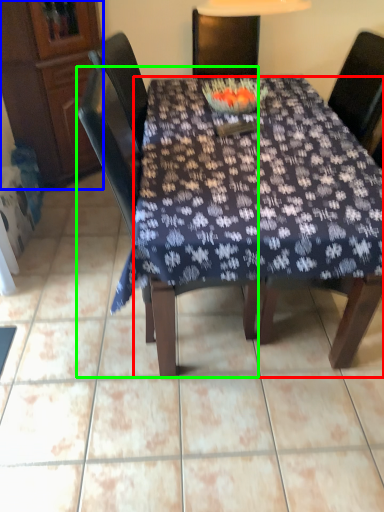
Question: Considering the real-world distances, which object is closest to desk (highlighted by a red box)? cabinetry (highlighted by a blue box) or chair (highlighted by a green box).

Choices:
 (A) cabinetry
 (B) chair

Answer: (B)